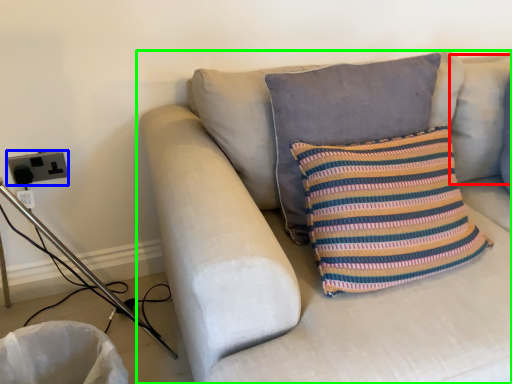
Question: Which object is the closest to the pillow (highlighted by a red box)? Choose among these: electric outlet (highlighted by a blue box) or studio couch (highlighted by a green box).

Choices:
 (A) electric outlet
 (B) studio couch

Answer: (B)